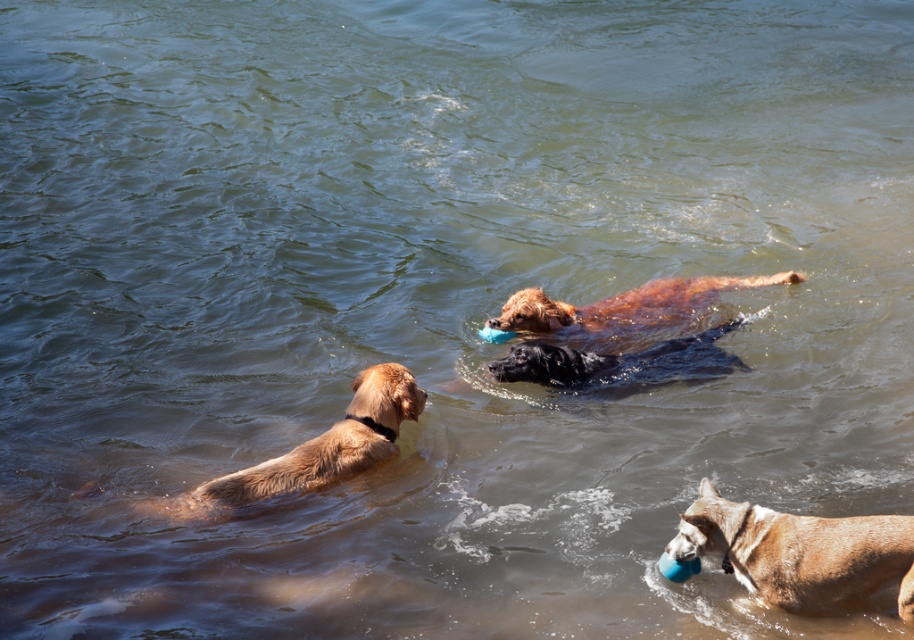
Does golden fur dog at left have a lesser width compared to black rubber dog at center?

Correct, golden fur dog at left's width is less than black rubber dog at center's.

Is golden fur dog at left to the left of black rubber dog at center from the viewer's perspective?

Yes, golden fur dog at left is to the left of black rubber dog at center.

Between point (346, 417) and point (682, 356), which one is positioned behind?

Point (682, 356)

Locate an element on the screen. The width and height of the screenshot is (914, 640). golden fur dog at left is located at coordinates click(314, 449).

Does brown matte dog at lower right have a smaller size compared to black rubber dog at center?

Correct, brown matte dog at lower right occupies less space than black rubber dog at center.

Is point (772, 582) closer to viewer compared to point (514, 372)?

Yes, point (772, 582) is closer to viewer.

Locate an element on the screen. The width and height of the screenshot is (914, 640). brown matte dog at lower right is located at coordinates (800, 552).

Is brown matte dog at lower right bigger than golden fur dog at left?

No.

Measure the distance between point [865,564] and camera.

Point [865,564] is 3.86 meters from camera.

Based on the photo, who is more forward, (812,586) or (368,419)?

Point (812,586) is more forward.

Where is `brown matte dog at lower right`? brown matte dog at lower right is located at coordinates (800, 552).